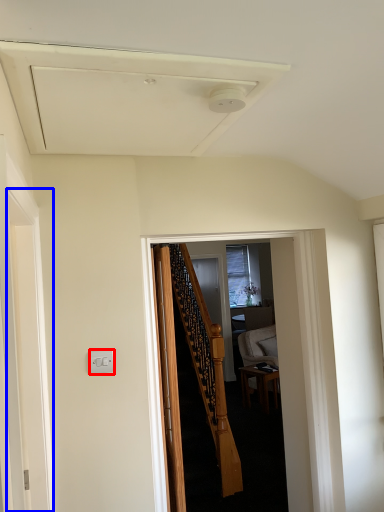
Question: Which of the following is the farthest to the observer, electric outlet (highlighted by a red box) or screen door (highlighted by a blue box)?

Choices:
 (A) electric outlet
 (B) screen door

Answer: (A)